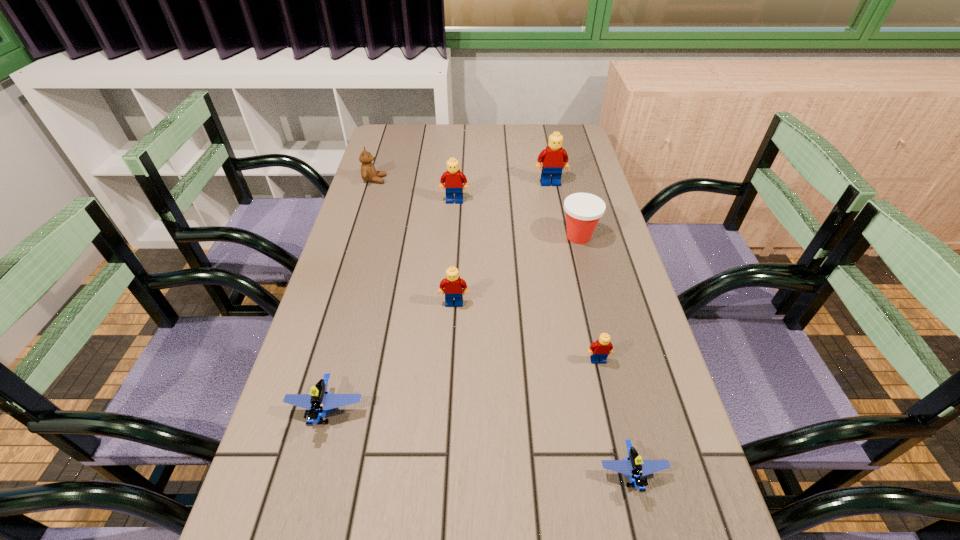
At what (x,y) coordinates should I click in order to perform the action: click on free region located on the front-facing side of the fifth farthest Lego. Please return your answer as a coordinate pair (x, y). The height and width of the screenshot is (540, 960). Looking at the image, I should click on (306, 488).

Find the location of a particular element. The width and height of the screenshot is (960, 540). vacant region located on the front-facing side of the sixth farthest object is located at coordinates (613, 429).

You are a GUI agent. You are given a task and a screenshot of the screen. Output one action in this format:
    pyautogui.click(x=<x>, y=<y>)
    Task: Click on the teddy bear present at the left edge
    
    Given the screenshot: What is the action you would take?
    pyautogui.click(x=368, y=172)

Where is `Lego located in the left edge section of the desktop`? This screenshot has width=960, height=540. Lego located in the left edge section of the desktop is located at coordinates (320, 400).

Locate an element on the screen. Image resolution: width=960 pixels, height=540 pixels. Dixie cup present at the right edge is located at coordinates (583, 210).

Identify the location of vacant space at the far edge of the desktop. (497, 146).

I want to click on vacant space at the left edge, so click(372, 251).

At what (x,y) coordinates should I click in order to perform the action: click on blank space at the right edge of the desktop. Please return your answer as a coordinate pair (x, y). Looking at the image, I should click on (630, 290).

I want to click on vacant space at the far left corner of the desktop, so click(x=386, y=143).

This screenshot has width=960, height=540. Identify the location of vacant space at the far right corner. (565, 138).